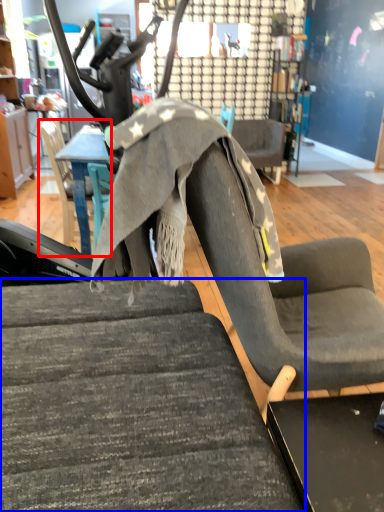
Question: Which object appears closest to the camera in this image, chair (highlighted by a red box) or chair (highlighted by a blue box)?

Choices:
 (A) chair
 (B) chair

Answer: (B)